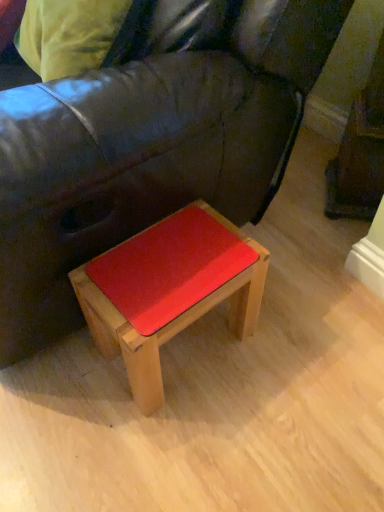
Describe the element at coordinates (149, 144) in the screenshot. This screenshot has width=384, height=512. I see `leather couch at center` at that location.

Locate an element on the screen. leather couch at center is located at coordinates (149, 144).

The width and height of the screenshot is (384, 512). Find the location of `wooden stool at lower center`. wooden stool at lower center is located at coordinates (169, 290).

This screenshot has height=512, width=384. Describe the element at coordinates (169, 290) in the screenshot. I see `wooden stool at lower center` at that location.

Locate an element on the screen. The width and height of the screenshot is (384, 512). leather couch at center is located at coordinates (149, 144).

Between wooden stool at lower center and leather couch at center, which one appears on the left side from the viewer's perspective?

From the viewer's perspective, leather couch at center appears more on the left side.

Is wooden stool at lower center positioned behind leather couch at center?

Yes, the depth of wooden stool at lower center is greater than that of leather couch at center.

Between point (175, 267) and point (234, 103), which one is positioned behind?

Point (175, 267)

From the image's perspective, which object appears higher, wooden stool at lower center or leather couch at center?

leather couch at center, from the image's perspective.

From a real-world perspective, is wooden stool at lower center over leather couch at center?

No, from a real-world perspective, wooden stool at lower center is not over leather couch at center

In the scene shown: Which object is thinner, wooden stool at lower center or leather couch at center?

wooden stool at lower center.

Can you confirm if wooden stool at lower center is shorter than leather couch at center?

Correct, wooden stool at lower center is not as tall as leather couch at center.

Can you confirm if wooden stool at lower center is smaller than leather couch at center?

Yes.

Would you say wooden stool at lower center is inside or outside leather couch at center?

wooden stool at lower center is not enclosed by leather couch at center.

Are wooden stool at lower center and leather couch at center located far from each other?

wooden stool at lower center is actually quite close to leather couch at center.

Does wooden stool at lower center turn towards leather couch at center?

No, wooden stool at lower center is not aimed at leather couch at center.

Looking at this image, what's the angular difference between wooden stool at lower center and leather couch at center's facing directions?

The facing directions of wooden stool at lower center and leather couch at center are 0.000994 degrees apart.

Locate an element on the screen. Image resolution: width=384 pixels, height=512 pixels. studio couch on the left of wooden stool at lower center is located at coordinates (149, 144).

Looking at this image, which is more to the right, leather couch at center or wooden stool at lower center?

From the viewer's perspective, wooden stool at lower center appears more on the right side.

Which is behind, leather couch at center or wooden stool at lower center?

wooden stool at lower center is more distant.

Does point (147, 76) come closer to viewer compared to point (126, 317)?

Yes, it is.

From the image's perspective, which is above, leather couch at center or wooden stool at lower center?

From the image's view, leather couch at center is above.

From a real-world perspective, is leather couch at center physically located above or below wooden stool at lower center?

In terms of real-world spatial position, leather couch at center is above wooden stool at lower center.

Is leather couch at center wider than wooden stool at lower center?

Yes.

Which of these two, leather couch at center or wooden stool at lower center, stands taller?

With more height is leather couch at center.

Considering the sizes of leather couch at center and wooden stool at lower center in the image, is leather couch at center bigger or smaller than wooden stool at lower center?

leather couch at center is bigger than wooden stool at lower center.

Is wooden stool at lower center completely or partially inside leather couch at center?

Yes, wooden stool at lower center is a part of leather couch at center.

Is leather couch at center with wooden stool at lower center?

leather couch at center is not next to wooden stool at lower center, and they're not touching.

Is leather couch at center oriented towards wooden stool at lower center?

No, leather couch at center is not facing towards wooden stool at lower center.

The width and height of the screenshot is (384, 512). In order to click on table that appears below the leather couch at center (from a real-world perspective) in this screenshot , I will do `click(169, 290)`.

This screenshot has width=384, height=512. Find the location of `studio couch that appears above the wooden stool at lower center (from a real-world perspective)`. studio couch that appears above the wooden stool at lower center (from a real-world perspective) is located at coordinates tap(149, 144).

Find the location of `table located on the right of leather couch at center`. table located on the right of leather couch at center is located at coordinates (169, 290).